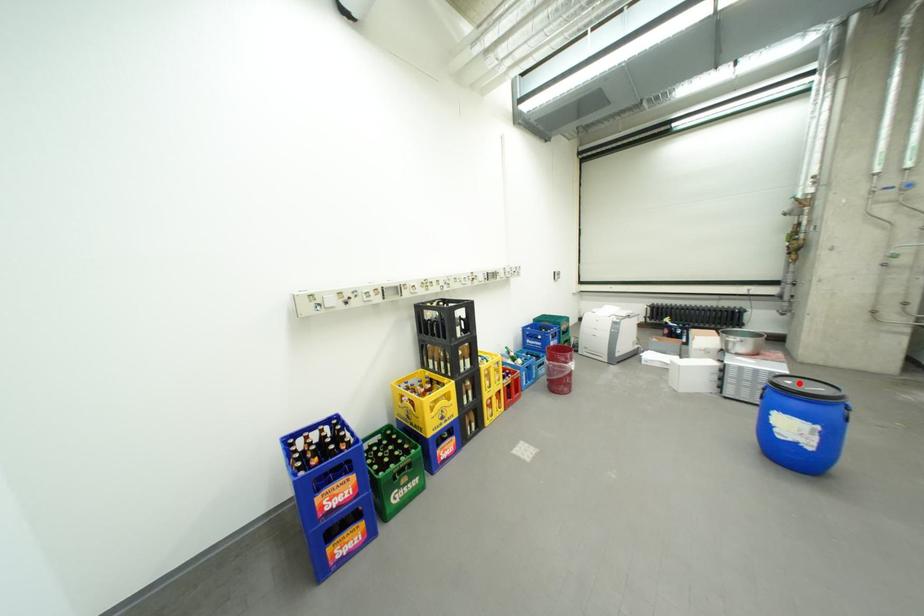
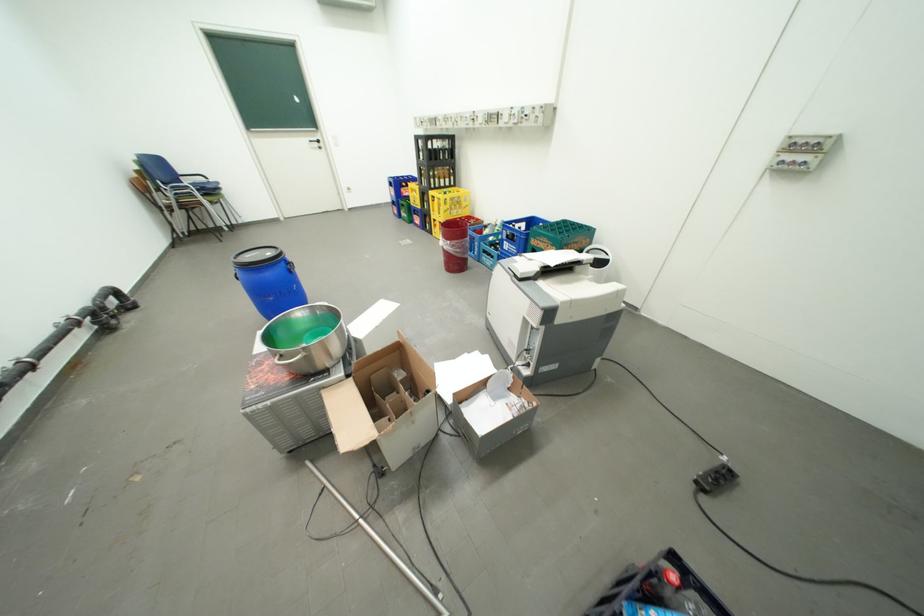
Question: I am providing you with two images of the same scene from different viewpoints. A red point is marked on the first image. Is the red point's position out of view in image 2?

Choices:
 (A) Yes
 (B) No

Answer: (A)